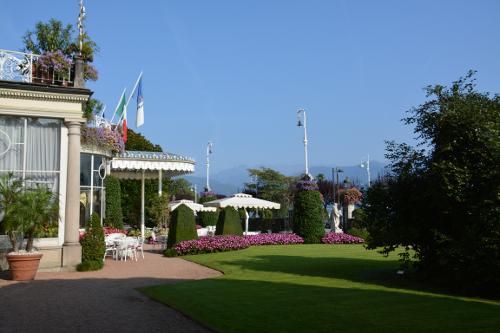
Where is `curtains in windows`? The height and width of the screenshot is (333, 500). curtains in windows is located at coordinates (38, 151), (11, 158).